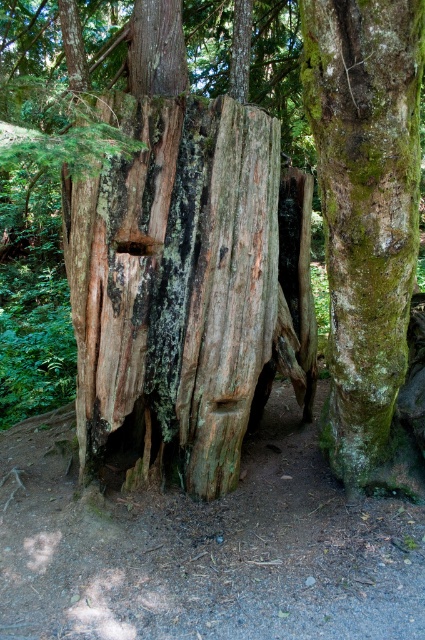
Question: Which object is positioned farthest from the green mossy bark at center?

Choices:
 (A) smooth brown wood at center
 (B) smooth wood hole at center

Answer: (A)

Question: Which point is closer to the camera?

Choices:
 (A) (393, 291)
 (B) (139, 256)

Answer: (A)

Question: Does green mossy bark at center appear on the left side of smooth wood hole at center?

Choices:
 (A) no
 (B) yes

Answer: (A)

Question: Which of these objects is positioned farthest from the smooth brown wood at center?

Choices:
 (A) green mossy bark at center
 (B) smooth wood hole at center

Answer: (A)

Question: Can you confirm if smooth brown wood at center is bigger than smooth wood hole at center?

Choices:
 (A) yes
 (B) no

Answer: (A)

Question: Is green mossy bark at center bigger than smooth brown wood at center?

Choices:
 (A) yes
 (B) no

Answer: (A)